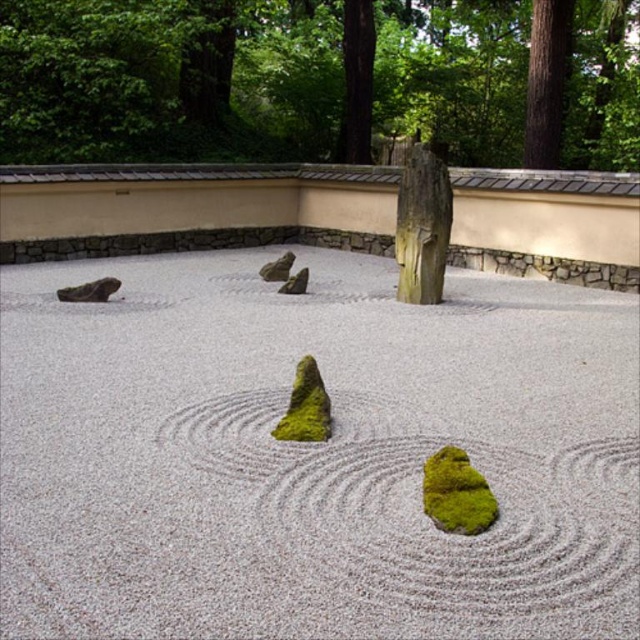
Question: Is green mossy tree stump at center to the right of green mossy rock at center from the viewer's perspective?

Choices:
 (A) yes
 (B) no

Answer: (A)

Question: Which is nearer to the green mossy rock at center?

Choices:
 (A) white gravel at center
 (B) green mossy tree stump at center

Answer: (A)

Question: Can you confirm if white gravel at center is positioned to the right of green mossy tree stump at center?

Choices:
 (A) yes
 (B) no

Answer: (A)

Question: Which object is farther from the camera taking this photo?

Choices:
 (A) green mossy tree stump at center
 (B) green mossy stump at center
 (C) white gravel at center

Answer: (A)

Question: Can you confirm if white gravel at center is thinner than green mossy tree stump at center?

Choices:
 (A) yes
 (B) no

Answer: (A)

Question: Which point is farther from the camera taking this photo?

Choices:
 (A) (280, 257)
 (B) (428, 38)
 (C) (298, 440)

Answer: (B)